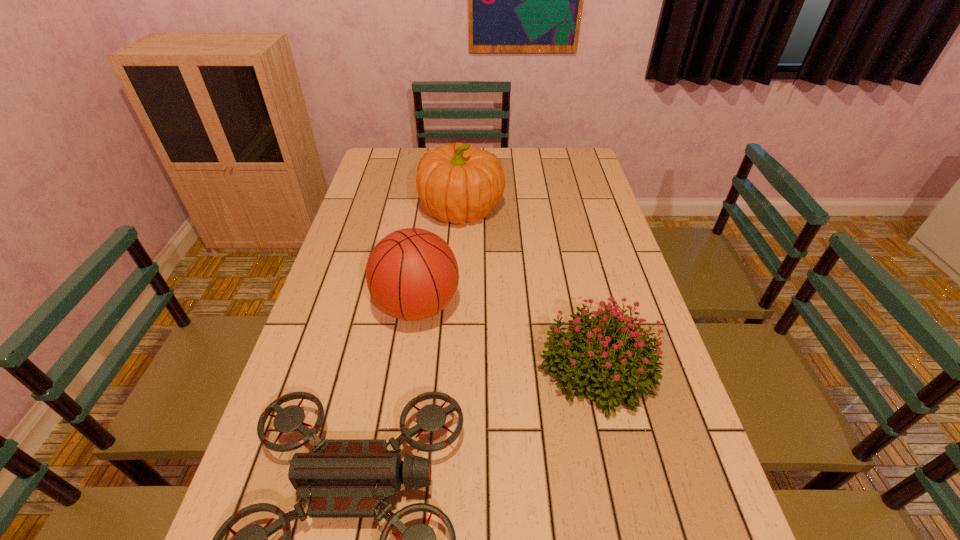
Identify the location of pumpkin. This screenshot has width=960, height=540. (456, 183).

What are the coordinates of `basketball` in the screenshot? It's located at (412, 274).

Locate an element on the screen. the rightmost object is located at coordinates (635, 367).

At what (x,y) coordinates should I click in order to perform the action: click on free location located on the surface of the pumpkin. Please return your answer as a coordinate pair (x, y). Looking at the image, I should click on (521, 210).

Where is `free location located on the back of the basketball`? free location located on the back of the basketball is located at coordinates (426, 243).

At what (x,y) coordinates should I click in order to perform the action: click on vacant space positioned on the left of the rightmost object. Please return your answer as a coordinate pair (x, y). Image resolution: width=960 pixels, height=540 pixels. Looking at the image, I should click on (440, 368).

The image size is (960, 540). Identify the location of object present at the left edge. click(x=412, y=274).

I want to click on object located in the right edge section of the desktop, so click(x=635, y=367).

In the image, there is a desktop. Identify the location of vacant region at the far edge. The image size is (960, 540). click(532, 152).

This screenshot has width=960, height=540. Identify the location of vacant space at the left edge. (360, 356).